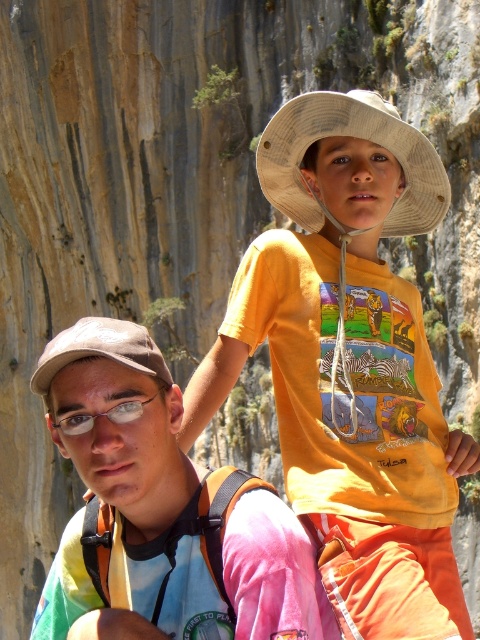
Question: Can you confirm if yellow cotton shirt at upper center is thinner than tie-dye fabric shirt at lower left?

Choices:
 (A) no
 (B) yes

Answer: (B)

Question: Which object is closer to the camera taking this photo?

Choices:
 (A) tie-dye fabric shirt at lower left
 (B) yellow cotton shirt at upper center

Answer: (A)

Question: Which of the following is the farthest from the observer?

Choices:
 (A) yellow cotton shirt at upper center
 (B) tie-dye fabric shirt at lower left

Answer: (A)

Question: Which of the following is the closest to the observer?

Choices:
 (A) pyautogui.click(x=249, y=556)
 (B) pyautogui.click(x=424, y=529)

Answer: (A)

Question: Can you confirm if yellow cotton shirt at upper center is positioned below tie-dye fabric shirt at lower left?

Choices:
 (A) no
 (B) yes

Answer: (A)

Question: Is yellow cotton shirt at upper center to the right of tie-dye fabric shirt at lower left from the viewer's perspective?

Choices:
 (A) yes
 (B) no

Answer: (A)